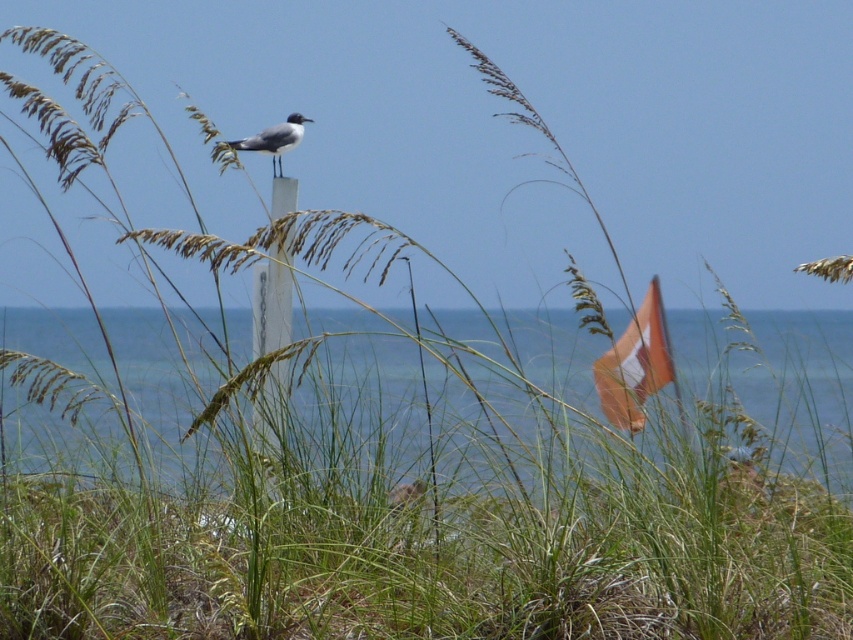
From the picture: Is white plastic pole at center smaller than white glossy bird at center?

No, white plastic pole at center is not smaller than white glossy bird at center.

In the scene shown: Which of these two, white plastic pole at center or white glossy bird at center, stands taller?

white plastic pole at center

Does point (271, 314) lie behind point (293, 132)?

No, it is not.

Identify the location of white plastic pole at center. This screenshot has width=853, height=640. (271, 304).

Is white plastic pole at center positioned behind orange fabric flag at right?

Yes, white plastic pole at center is behind orange fabric flag at right.

Is white plastic pole at center taller than orange fabric flag at right?

Yes.

Does point (281, 256) lie in front of point (622, 385)?

Yes, point (281, 256) is closer to viewer.

You are a GUI agent. You are given a task and a screenshot of the screen. Output one action in this format:
    pyautogui.click(x=<x>, y=<y>)
    Task: Click on the white plastic pole at center
    
    Given the screenshot: What is the action you would take?
    pyautogui.click(x=271, y=304)

Is orange fabric flag at right to the left of white glossy bird at center from the viewer's perspective?

Incorrect, orange fabric flag at right is not on the left side of white glossy bird at center.

Is point (628, 355) in front of point (282, 140)?

No, (628, 355) is further to viewer.

Find the location of a particular element. This screenshot has width=853, height=640. orange fabric flag at right is located at coordinates (635, 364).